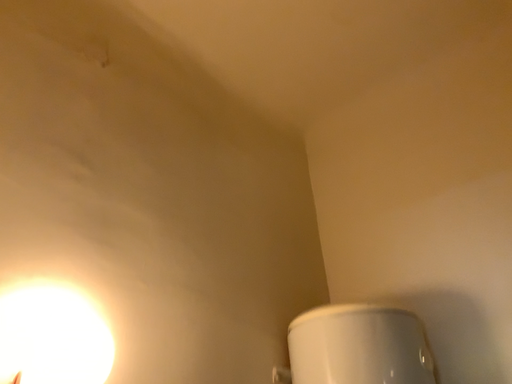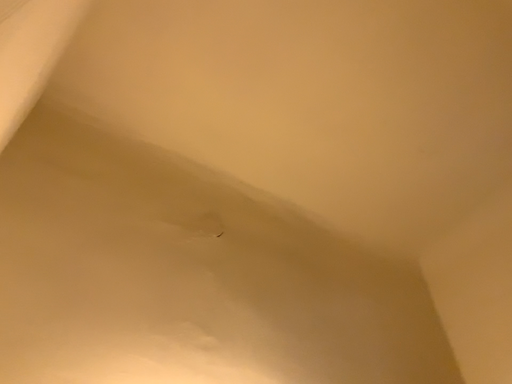
Question: Which way did the camera rotate in the video?

Choices:
 (A) rotated upward
 (B) rotated downward

Answer: (A)